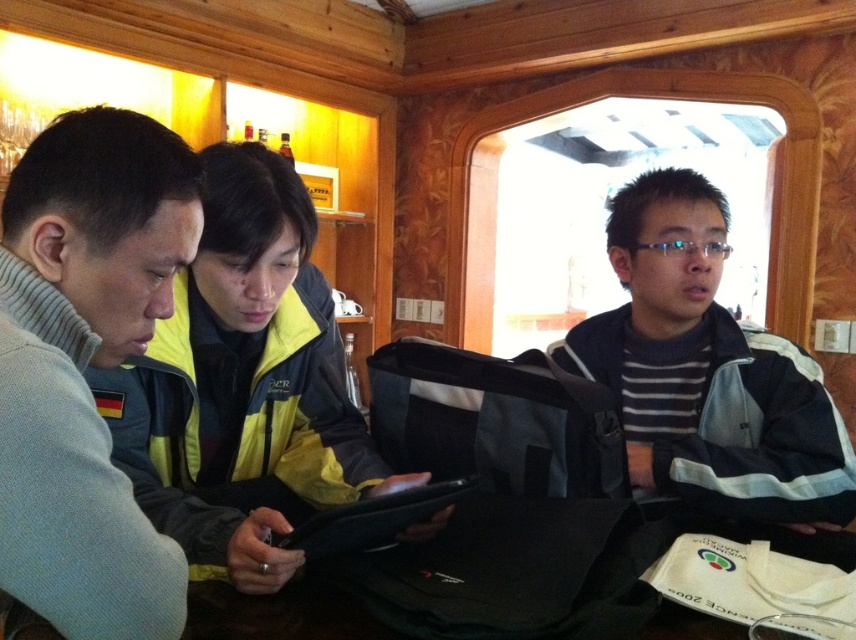
Question: Is yellow reflective jacket at center positioned in front of striped knit sweater at center?

Choices:
 (A) no
 (B) yes

Answer: (B)

Question: Does yellow reflective jacket at center appear under striped knit sweater at center?

Choices:
 (A) yes
 (B) no

Answer: (B)

Question: Which object is farther from the camera taking this photo?

Choices:
 (A) matte gray sweater at left
 (B) striped knit sweater at center

Answer: (B)

Question: Is yellow reflective jacket at center positioned behind striped knit sweater at center?

Choices:
 (A) yes
 (B) no

Answer: (B)

Question: Among these objects, which one is farthest from the camera?

Choices:
 (A) matte gray sweater at left
 (B) striped knit sweater at center

Answer: (B)

Question: Which object is positioned farthest from the yellow reflective jacket at center?

Choices:
 (A) striped knit sweater at center
 (B) matte gray sweater at left

Answer: (A)